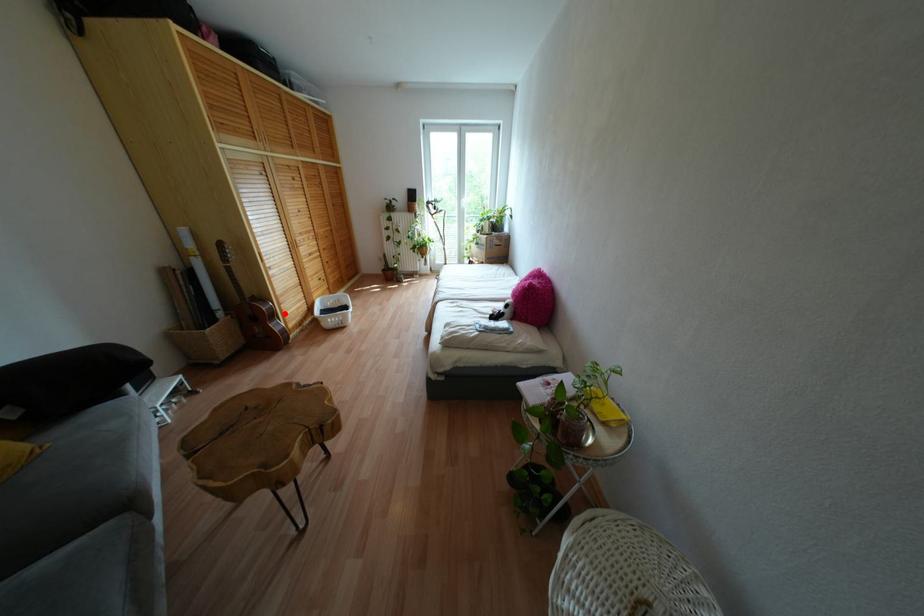
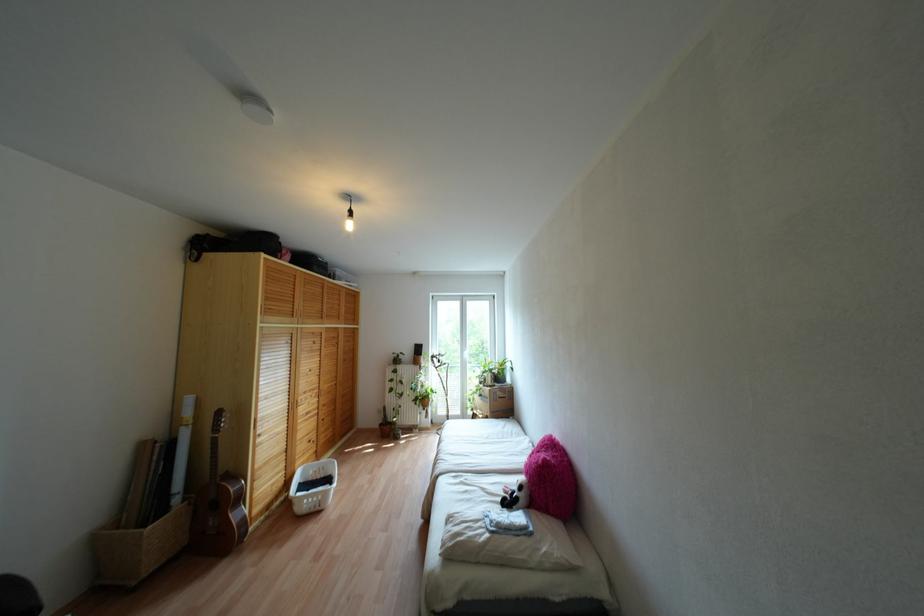
Question: I am providing you with two images of the same scene from different viewpoints. In image1, a red point is highlighted. Considering the same 3D point in image2, which of the following is correct?

Choices:
 (A) It is closer
 (B) It is farther

Answer: (B)